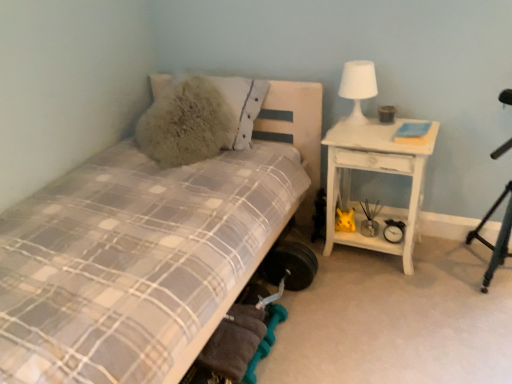
What do you see at coordinates (358, 87) in the screenshot?
I see `white matte table lamp at upper right` at bounding box center [358, 87].

In order to click on white wood nightstand at right in this screenshot , I will do `click(376, 171)`.

The width and height of the screenshot is (512, 384). What are the coordinates of `white matte table lamp at upper right` in the screenshot? It's located at (358, 87).

Is point (358, 216) closer or farther from the camera than point (510, 222)?

Point (358, 216) is positioned farther from the camera compared to point (510, 222).

Does white wood nightstand at right have a smaller size compared to teal metallic tripod at right?

No, white wood nightstand at right is not smaller than teal metallic tripod at right.

Is the surface of white wood nightstand at right in direct contact with teal metallic tripod at right?

white wood nightstand at right and teal metallic tripod at right are clearly separated.

Is white wood nightstand at right facing away from teal metallic tripod at right?

No.

Which point is more distant from viewer, (x=476, y=235) or (x=246, y=86)?

The point (x=246, y=86) is more distant.

Are teal metallic tripod at right and fuzzy beige pillow at upper left beside each other?

No, teal metallic tripod at right is not making contact with fuzzy beige pillow at upper left.

Is teal metallic tripod at right looking in the opposite direction of fuzzy beige pillow at upper left?

teal metallic tripod at right is not turned away from fuzzy beige pillow at upper left.

Could you tell me if teal metallic tripod at right is facing plaid fabric bed at left?

No.

Considering the relative sizes of teal metallic tripod at right and plaid fabric bed at left in the image provided, is teal metallic tripod at right bigger than plaid fabric bed at left?

Incorrect, teal metallic tripod at right is not larger than plaid fabric bed at left.

Is teal metallic tripod at right spatially inside plaid fabric bed at left, or outside of it?

teal metallic tripod at right is outside plaid fabric bed at left.

Does white matte table lamp at upper right turn towards teal metallic tripod at right?

No, white matte table lamp at upper right is not oriented towards teal metallic tripod at right.

Image resolution: width=512 pixels, height=384 pixels. I want to click on table lamp above the teal metallic tripod at right (from the image's perspective), so click(x=358, y=87).

Choose the correct answer: Is white matte table lamp at upper right inside teal metallic tripod at right or outside it?

white matte table lamp at upper right is spatially situated outside teal metallic tripod at right.

How many degrees apart are the facing directions of white matte table lamp at upper right and teal metallic tripod at right?

They differ by 2.6 degrees in their facing directions.

Measure the distance from white wood nightstand at right to fuzzy beige pillow at upper left.

white wood nightstand at right and fuzzy beige pillow at upper left are 25.07 inches apart from each other.

Considering the relative positions of white wood nightstand at right and fuzzy beige pillow at upper left in the image provided, is white wood nightstand at right to the left or to the right of fuzzy beige pillow at upper left?

Based on their positions, white wood nightstand at right is located to the right of fuzzy beige pillow at upper left.

Between point (364, 142) and point (231, 103), which one is positioned behind?

Point (231, 103)

Is white wood nightstand at right next to fuzzy beige pillow at upper left?

No, white wood nightstand at right is not with fuzzy beige pillow at upper left.

Is fuzzy beige pillow at upper left smaller than white wood nightstand at right?

Indeed, fuzzy beige pillow at upper left has a smaller size compared to white wood nightstand at right.

Is fuzzy beige pillow at upper left facing towards white wood nightstand at right?

No, fuzzy beige pillow at upper left is not aimed at white wood nightstand at right.

Considering the relative sizes of fuzzy beige pillow at upper left and white wood nightstand at right in the image provided, is fuzzy beige pillow at upper left taller than white wood nightstand at right?

No, fuzzy beige pillow at upper left is not taller than white wood nightstand at right.

Are white matte table lamp at upper right and white wood nightstand at right making contact?

white matte table lamp at upper right is not next to white wood nightstand at right, and they're not touching.

Between white matte table lamp at upper right and white wood nightstand at right, which one appears on the right side from the viewer's perspective?

From the viewer's perspective, white wood nightstand at right appears more on the right side.

Who is bigger, white matte table lamp at upper right or white wood nightstand at right?

white wood nightstand at right.

Would you say white matte table lamp at upper right is outside white wood nightstand at right?

Yes.

The image size is (512, 384). I want to click on nightstand that appears behind the teal metallic tripod at right, so click(x=376, y=171).

Identify the location of pillow above the teal metallic tripod at right (from a real-world perspective). (242, 104).

Based on their spatial positions, is white wood nightstand at right or plaid fabric bed at left closer to fuzzy beige pillow at upper left?

The object closer to fuzzy beige pillow at upper left is white wood nightstand at right.

Looking at this image, based on their spatial positions, is white matte table lamp at upper right or plaid fabric bed at left closer to white wood nightstand at right?

white matte table lamp at upper right is positioned closer to the anchor white wood nightstand at right.

Based on the photo, considering their positions, is white matte table lamp at upper right positioned closer to fuzzy beige pillow at upper left than white wood nightstand at right?

Based on the image, white matte table lamp at upper right appears to be nearer to fuzzy beige pillow at upper left.

Based on their spatial positions, is teal metallic tripod at right or white wood nightstand at right further from white matte table lamp at upper right?

Based on the image, teal metallic tripod at right appears to be further to white matte table lamp at upper right.

From the image, which object appears to be nearer to plaid fabric bed at left, fuzzy beige pillow at upper left or white wood nightstand at right?

The object closer to plaid fabric bed at left is fuzzy beige pillow at upper left.

Based on their spatial positions, is teal metallic tripod at right or fuzzy beige pillow at upper left further from white matte table lamp at upper right?

Based on the image, teal metallic tripod at right appears to be further to white matte table lamp at upper right.

When comparing their distances from white matte table lamp at upper right, does teal metallic tripod at right or plaid fabric bed at left seem closer?

teal metallic tripod at right is positioned closer to the anchor white matte table lamp at upper right.

Considering their positions, is white matte table lamp at upper right positioned closer to plaid fabric bed at left than white wood nightstand at right?

white wood nightstand at right is positioned closer to the anchor plaid fabric bed at left.

Image resolution: width=512 pixels, height=384 pixels. I want to click on pillow between plaid fabric bed at left and teal metallic tripod at right from left to right, so click(242, 104).

The image size is (512, 384). Identify the location of table lamp between fuzzy beige pillow at upper left and white wood nightstand at right from left to right. pyautogui.click(x=358, y=87).

Locate an element on the screen. The height and width of the screenshot is (384, 512). table lamp positioned between plaid fabric bed at left and fuzzy beige pillow at upper left from near to far is located at coordinates (358, 87).

You are a GUI agent. You are given a task and a screenshot of the screen. Output one action in this format:
    pyautogui.click(x=<x>, y=<y>)
    Task: Click on the table lamp between fuzzy beige pillow at upper left and teal metallic tripod at right from left to right
    
    Given the screenshot: What is the action you would take?
    pyautogui.click(x=358, y=87)